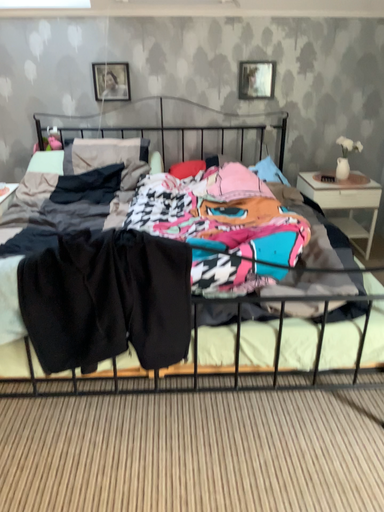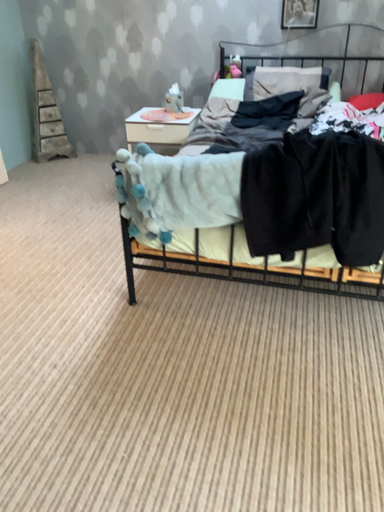
Question: Which way did the camera rotate in the video?

Choices:
 (A) rotated right
 (B) rotated left

Answer: (B)